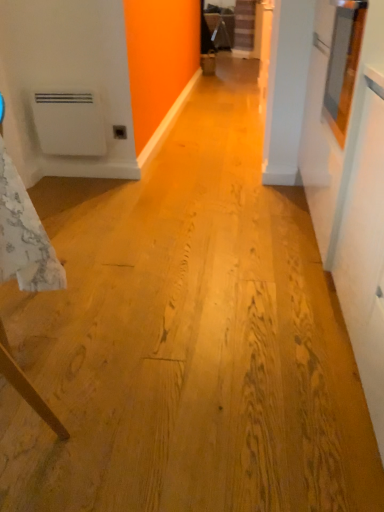
Question: Is white matte water heater at left oriented towards matte plastic outlet at center?

Choices:
 (A) yes
 (B) no

Answer: (B)

Question: Is white matte water heater at left positioned far away from matte plastic outlet at center?

Choices:
 (A) no
 (B) yes

Answer: (A)

Question: Can you confirm if white matte water heater at left is bigger than matte plastic outlet at center?

Choices:
 (A) yes
 (B) no

Answer: (A)

Question: From a real-world perspective, is white matte water heater at left on top of matte plastic outlet at center?

Choices:
 (A) yes
 (B) no

Answer: (A)

Question: Is white matte water heater at left closer to the viewer compared to matte plastic outlet at center?

Choices:
 (A) yes
 (B) no

Answer: (A)

Question: In the image, is white textured tablecloth at left positioned in front of or behind matte plastic outlet at center?

Choices:
 (A) behind
 (B) front

Answer: (B)

Question: In terms of width, does white textured tablecloth at left look wider or thinner when compared to matte plastic outlet at center?

Choices:
 (A) thin
 (B) wide

Answer: (B)

Question: Would you say white textured tablecloth at left is to the left or to the right of matte plastic outlet at center in the picture?

Choices:
 (A) left
 (B) right

Answer: (A)

Question: From a real-world perspective, is white textured tablecloth at left positioned above or below matte plastic outlet at center?

Choices:
 (A) below
 (B) above

Answer: (B)

Question: Is white matte water heater at left in front of or behind matte plastic outlet at center in the image?

Choices:
 (A) front
 (B) behind

Answer: (A)

Question: Is point (51, 126) positioned closer to the camera than point (114, 138)?

Choices:
 (A) closer
 (B) farther

Answer: (A)

Question: Is white matte water heater at left bigger or smaller than matte plastic outlet at center?

Choices:
 (A) small
 (B) big

Answer: (B)

Question: Considering the relative positions of white matte water heater at left and matte plastic outlet at center in the image provided, is white matte water heater at left to the left or to the right of matte plastic outlet at center?

Choices:
 (A) right
 (B) left

Answer: (B)

Question: Is white matte water heater at left bigger or smaller than white textured tablecloth at left?

Choices:
 (A) big
 (B) small

Answer: (B)

Question: From a real-world perspective, relative to white textured tablecloth at left, is white matte water heater at left vertically above or below?

Choices:
 (A) above
 (B) below

Answer: (B)